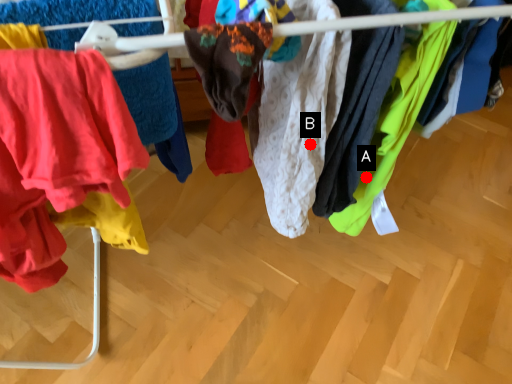
Question: Two points are circled on the image, labeled by A and B beside each circle. Which point is closer to the camera?

Choices:
 (A) A is closer
 (B) B is closer

Answer: (B)